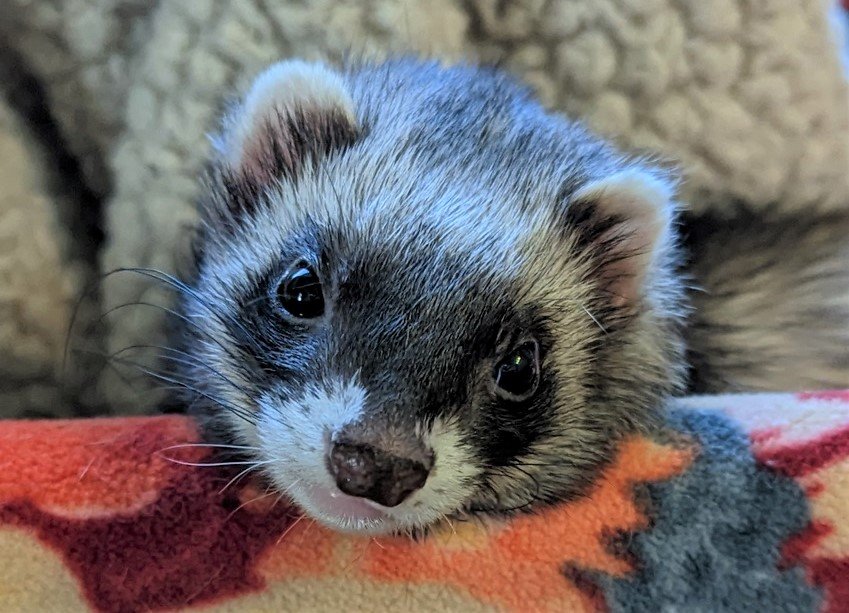
The width and height of the screenshot is (849, 613). Find the location of `gray coloring on blanket`. gray coloring on blanket is located at coordinates (700, 528).